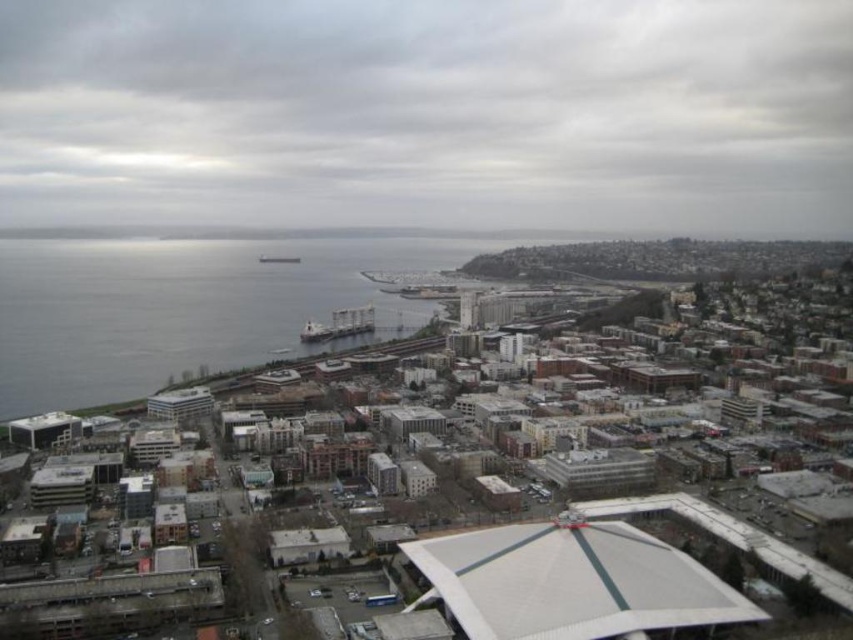
Question: Which point appears farthest from the camera in this image?

Choices:
 (A) (21, 61)
 (B) (61, 273)

Answer: (A)

Question: Which point appears closest to the camera in this image?

Choices:
 (A) click(15, 260)
 (B) click(248, 164)

Answer: (A)

Question: Is gray cloudy sky at upper center thinner than gray water at left?

Choices:
 (A) yes
 (B) no

Answer: (B)

Question: Is gray cloudy sky at upper center below gray water at left?

Choices:
 (A) yes
 (B) no

Answer: (B)

Question: Does gray cloudy sky at upper center appear over gray water at left?

Choices:
 (A) yes
 (B) no

Answer: (A)